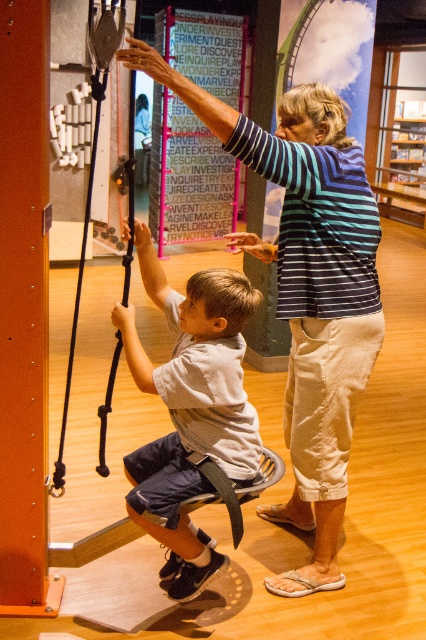
Who is positioned more to the left, gray fabric shirt at center or black rubber swing at left?

From the viewer's perspective, black rubber swing at left appears more on the left side.

Measure the distance between point (131, 499) and camera.

They are 2.15 meters apart.

The width and height of the screenshot is (426, 640). I want to click on gray fabric shirt at center, so click(x=190, y=410).